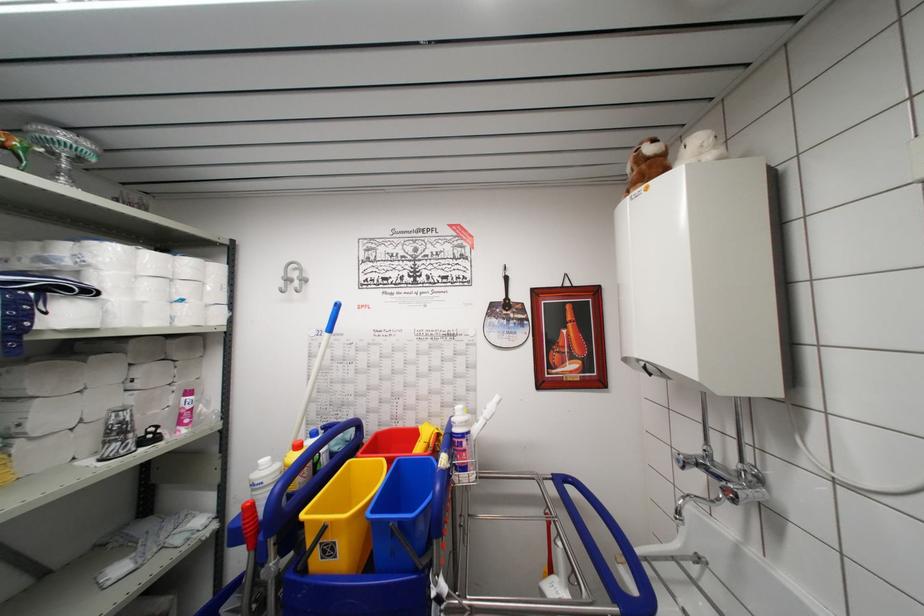
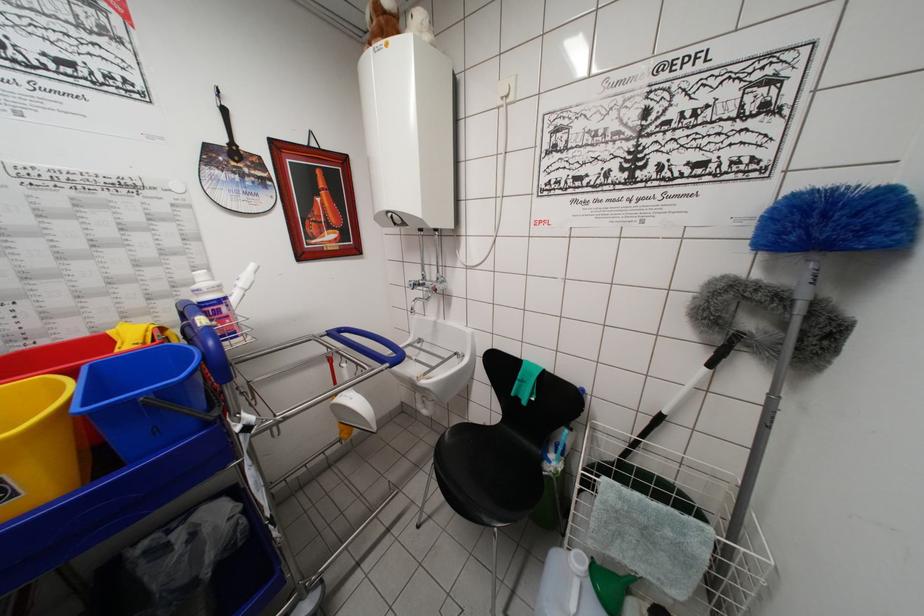
Locate, in the second image, the point that corresponds to [749,499] in the first image.

(443, 292)